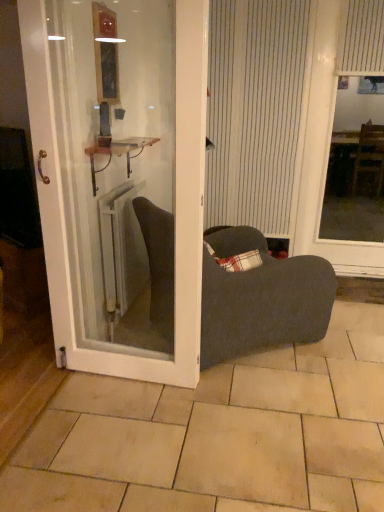
What do you see at coordinates (116, 153) in the screenshot?
I see `metallic copper cabinet at center` at bounding box center [116, 153].

Measure the distance between metallic copper cabinet at center and camera.

They are 6.92 feet apart.

What do you see at coordinates (121, 247) in the screenshot? The image size is (384, 512). I see `white metallic radiator at center` at bounding box center [121, 247].

What is the approximate width of white striped curtain at center, placed as the 2th curtain when sorted from right to left?

The width of white striped curtain at center, placed as the 2th curtain when sorted from right to left, is 6.16 centimeters.

The image size is (384, 512). Find the location of `beige tile at center`. beige tile at center is located at coordinates point(219,434).

The height and width of the screenshot is (512, 384). Identify the location of cabinetry in front of the wooden frame mirror at upper center. (116, 153).

Is metallic copper cabinet at center looking in the opposite direction of wooden frame mirror at upper center?

metallic copper cabinet at center does not have its back to wooden frame mirror at upper center.

How different are the orientations of metallic copper cabinet at center and wooden frame mirror at upper center in degrees?

There is a 0.0194-degree angle between the facing directions of metallic copper cabinet at center and wooden frame mirror at upper center.

From a real-world perspective, is beige tile at center physically above white glossy door at center?

Actually, beige tile at center is physically below white glossy door at center in the real world.

Would you say beige tile at center is outside white glossy door at center?

Yes, beige tile at center is located beyond the bounds of white glossy door at center.

You are a GUI agent. You are given a task and a screenshot of the screen. Output one action in this format:
    pyautogui.click(x=<x>, y=<y>)
    Task: Click on the door on the left of the beige tile at center
    The image size is (384, 512).
    Given the screenshot: What is the action you would take?
    pyautogui.click(x=176, y=199)

Between beige tile at center and white glossy door at center, which one has smaller size?

With smaller size is white glossy door at center.

Is white metallic radiator at center far away from white glossy door at center?

No, white metallic radiator at center is not far away from white glossy door at center.

This screenshot has width=384, height=512. In order to click on door above the white metallic radiator at center (from the image's perspective) in this screenshot , I will do `click(176, 199)`.

From a real-world perspective, which object rests below the other?

white metallic radiator at center.

Can you confirm if white metallic radiator at center is positioned to the left of white glossy door at center?

Yes.

Is plaid fabric pillow at center not within white striped curtain at upper right, acting as the first curtain starting from the right?

Indeed, plaid fabric pillow at center is completely outside white striped curtain at upper right, acting as the first curtain starting from the right.

Looking at this image, does plaid fabric pillow at center have a smaller size compared to white striped curtain at upper right, acting as the first curtain starting from the right?

Indeed, plaid fabric pillow at center has a smaller size compared to white striped curtain at upper right, acting as the first curtain starting from the right.

In terms of width, does plaid fabric pillow at center look wider or thinner when compared to white striped curtain at upper right, acting as the first curtain starting from the right?

Considering their sizes, plaid fabric pillow at center looks broader than white striped curtain at upper right, acting as the first curtain starting from the right.

Locate an element on the screen. the 2nd curtain positioned above the plaid fabric pillow at center (from the image's perspective) is located at coordinates (361, 38).

What's the angular difference between metallic copper cabinet at center and beige tile at center's facing directions?

The angle between the facing direction of metallic copper cabinet at center and the facing direction of beige tile at center is 180 degrees.

Which is correct: metallic copper cabinet at center is inside beige tile at center, or outside of it?

metallic copper cabinet at center lies outside beige tile at center.

From a real-world perspective, is metallic copper cabinet at center on top of beige tile at center?

Indeed, from a real-world perspective, metallic copper cabinet at center stands above beige tile at center.

From the image's perspective, would you say wooden frame mirror at upper center is shown under white glossy door at center?

Actually, wooden frame mirror at upper center appears above white glossy door at center in the image.

Which is behind, point (109, 50) or point (190, 204)?

Point (109, 50)

Between wooden frame mirror at upper center and white glossy door at center, which one is positioned in front?

white glossy door at center is closer to the camera.

Is wooden frame mirror at upper center oriented towards white glossy door at center?

No.

Can you confirm if white striped window screen at right is positioned to the left of wooden frame mirror at upper center?

In fact, white striped window screen at right is to the right of wooden frame mirror at upper center.

Is white striped window screen at right not inside wooden frame mirror at upper center?

white striped window screen at right lies outside wooden frame mirror at upper center's area.

This screenshot has height=512, width=384. I want to click on cabinetry below the wooden frame mirror at upper center (from a real-world perspective), so click(x=116, y=153).

You are a GUI agent. You are given a task and a screenshot of the screen. Output one action in this format:
    pyautogui.click(x=<x>, y=<y>)
    Task: Click on the door above the beige tile at center (from a real-world perspective)
    This screenshot has width=384, height=512.
    Given the screenshot: What is the action you would take?
    pyautogui.click(x=176, y=199)

Which object lies further to the anchor point white striped curtain at center, placed as the 2th curtain when sorted from right to left, dark gray fabric chair at center or white striped curtain at upper right, arranged as the second curtain when viewed from the left?

dark gray fabric chair at center is further to white striped curtain at center, placed as the 2th curtain when sorted from right to left.

Considering their positions, is beige tile at center positioned further to white striped curtain at center, which ranks as the first curtain in left-to-right order, than dark gray fabric chair at center?

beige tile at center is further to white striped curtain at center, which ranks as the first curtain in left-to-right order.

Considering their positions, is white striped window screen at right positioned further to white glossy door at center than metallic copper cabinet at center?

The object further to white glossy door at center is white striped window screen at right.

Based on their spatial positions, is plaid fabric pillow at center or white striped curtain at center, placed as the 2th curtain when sorted from right to left, further from white striped curtain at upper right, acting as the first curtain starting from the right?

plaid fabric pillow at center is positioned further to the anchor white striped curtain at upper right, acting as the first curtain starting from the right.

Based on their spatial positions, is metallic copper cabinet at center or white glossy door at center further from white striped curtain at upper right, arranged as the second curtain when viewed from the left?

The object further to white striped curtain at upper right, arranged as the second curtain when viewed from the left, is white glossy door at center.

Which object lies nearer to the anchor point white striped curtain at upper right, arranged as the second curtain when viewed from the left, plaid fabric pillow at center or wooden frame mirror at upper center?

wooden frame mirror at upper center.

Based on their spatial positions, is wooden frame mirror at upper center or white metallic radiator at center closer to plaid fabric pillow at center?

white metallic radiator at center is closer to plaid fabric pillow at center.

When comparing their distances from white striped window screen at right, does white striped curtain at upper right, arranged as the second curtain when viewed from the left, or beige tile at center seem further?

beige tile at center is further to white striped window screen at right.

The width and height of the screenshot is (384, 512). Identify the location of window screen that lies between wooden frame mirror at upper center and beige tile at center from top to bottom. (324, 154).

At what (x,y) coordinates should I click in order to perform the action: click on radiator between wooden frame mirror at upper center and beige tile at center in the vertical direction. Please return your answer as a coordinate pair (x, y). Image resolution: width=384 pixels, height=512 pixels. Looking at the image, I should click on (121, 247).

This screenshot has height=512, width=384. I want to click on radiator between white striped curtain at upper right, arranged as the second curtain when viewed from the left, and dark gray fabric chair at center vertically, so click(x=121, y=247).

At what (x,y) coordinates should I click in order to perform the action: click on radiator situated between wooden frame mirror at upper center and white striped curtain at upper right, acting as the first curtain starting from the right, from left to right. Please return your answer as a coordinate pair (x, y). This screenshot has height=512, width=384. Looking at the image, I should click on (121, 247).